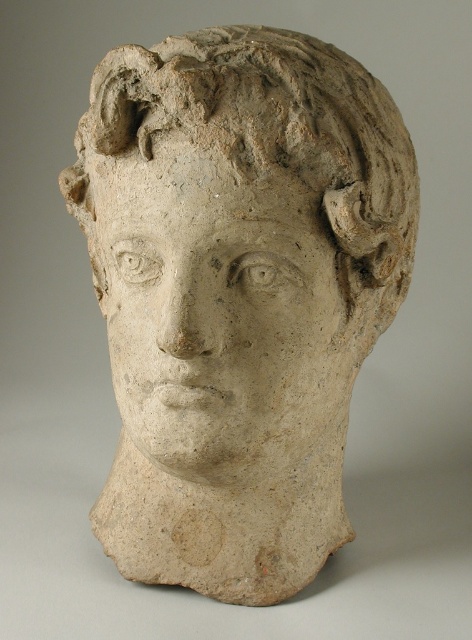
You are an art conservator examining two sculptures in a museum. You see the matte clay head at center and the matte stone face at center. Which sculpture has a greater width?

The matte clay head at center has a greater width than the matte stone face at center according to the description.

You are an art conservator examining a classical sculpture. You notice two layers on the central part of the sculpture. The upper layer is the matte clay head at center, and the lower layer is the matte stone face at center. Can you determine which layer is on top?

The matte clay head at center is positioned over the matte stone face at center, so the clay layer is on top.